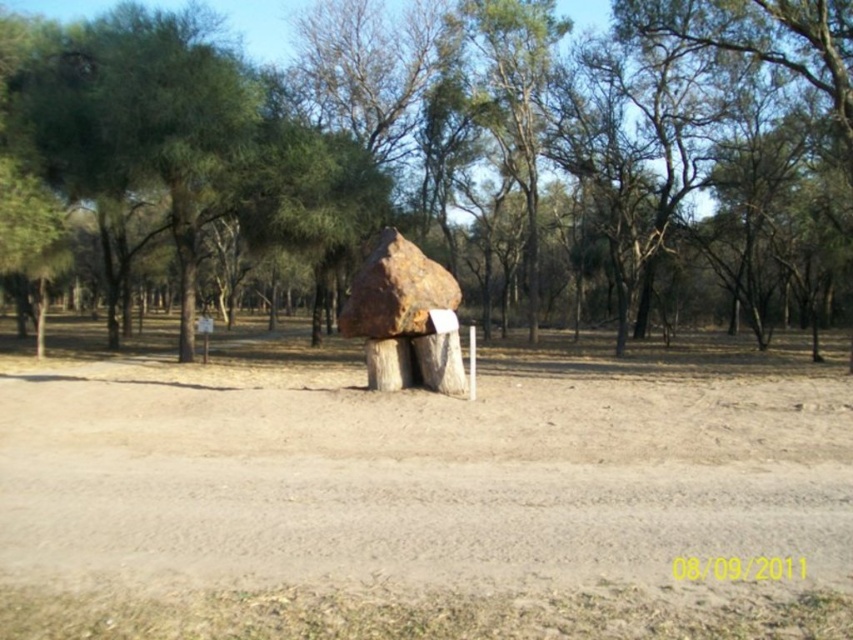
Is point (364, 609) less distant than point (109, 291)?

Yes, it is.

Is point (724, 392) behind point (27, 232)?

No, (724, 392) is closer to viewer.

Is point (26, 484) behind point (218, 180)?

No.

What are the coordinates of `brown dirt field at center` in the screenshot? It's located at (421, 493).

Who is lower down, brown dirt field at center or rustic wood sculpture at center?

brown dirt field at center

Can you confirm if brown dirt field at center is wider than rustic wood sculpture at center?

Incorrect, brown dirt field at center's width does not surpass rustic wood sculpture at center's.

Between point (434, 452) and point (100, 141), which one is positioned behind?

The point (100, 141) is behind.

Where is `brown dirt field at center`? The height and width of the screenshot is (640, 853). brown dirt field at center is located at coordinates (421, 493).

Between rustic wood sculpture at center and green leafy tree at upper center, which one is positioned higher?

Positioned higher is rustic wood sculpture at center.

Which is more to the left, rustic wood sculpture at center or green leafy tree at upper center?

green leafy tree at upper center is more to the left.

Where is `rustic wood sculpture at center`? This screenshot has width=853, height=640. rustic wood sculpture at center is located at coordinates (474, 147).